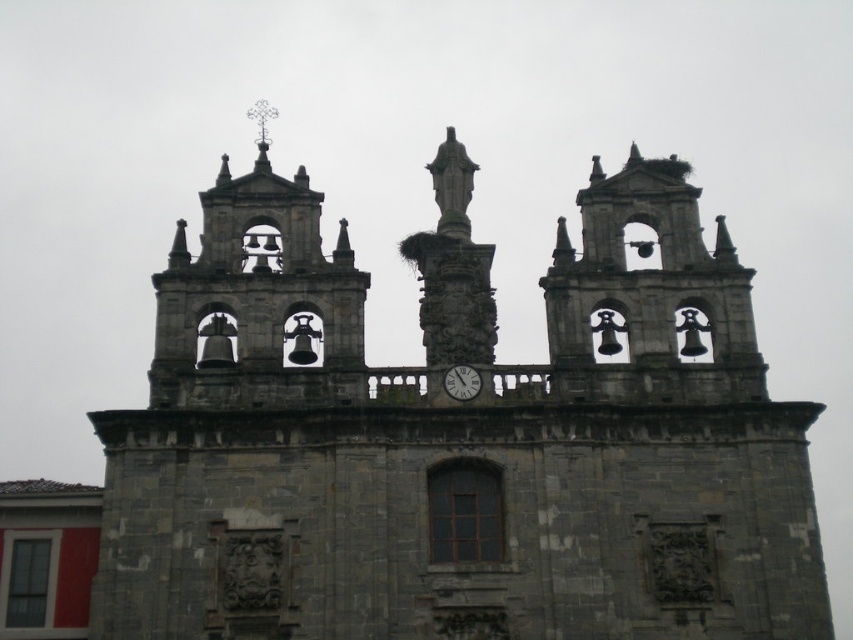
You are an architect examining the historic stone building. You notice the gray stone church at center and the white glossy clock at center. Which object appears closer to you from your viewing position?

The gray stone church at center is in front of the white glossy clock at center, so it appears closer to you.

You are standing in front of the historic stone building and want to take a photo. You notice two points marked on the building. Which point, point (682, 513) or point (450, 392), will appear larger in your photo?

Point (682, 513) is closer to the camera than point (450, 392), so it will appear larger in the photo.